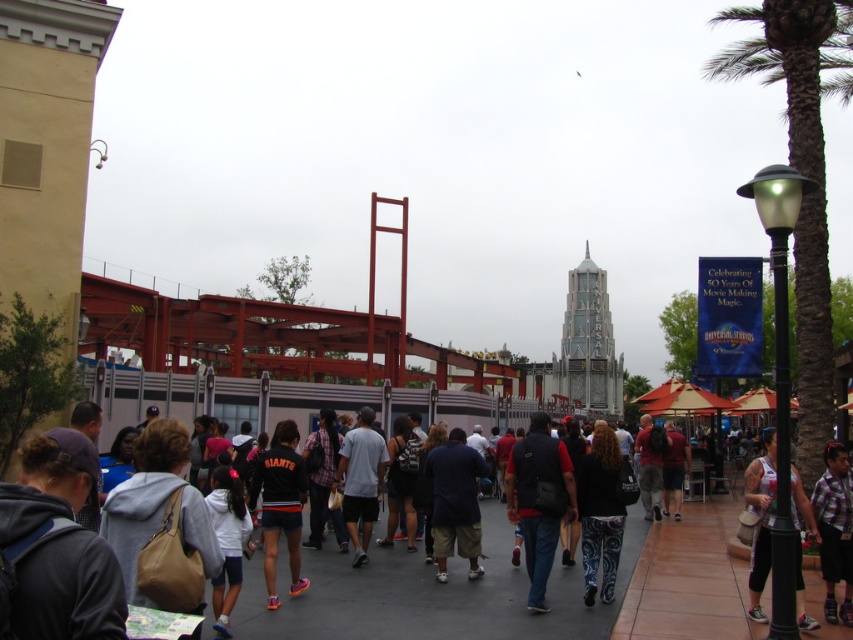
You are standing in the Universal Studios Hollywood crowd and want to take a photo of both the point at coordinates (160, 342) and the point at (589, 604). Which point should you focus on first to ensure both are in focus?

You should focus on the point at coordinates (160, 342) first because it is closer to the camera than the point at (589, 604). This ensures that both points will be in focus as the camera adjusts the depth of field.

You are a photographer standing at the Universal Studios Hollywood pathway. You need to capture a photo of both the dark gray hoodie at lower left and the camouflage pants at center. Which object is narrower in width so that you can frame them properly?

The dark gray hoodie at lower left is narrower in width than the camouflage pants at center, so you can frame them properly by positioning the dark gray hoodie at lower left closer to the edge of the frame to accommodate both subjects.

You are a photographer trying to capture a candid shot of the dark blue fabric pants at center and the purple checkered shirt at lower right. Which of the two items should you focus on first if you want to include both in your frame without moving your camera?

You should focus on the purple checkered shirt at lower right first because it occupies more space than the dark blue fabric pants at center, ensuring it fits well within the frame.